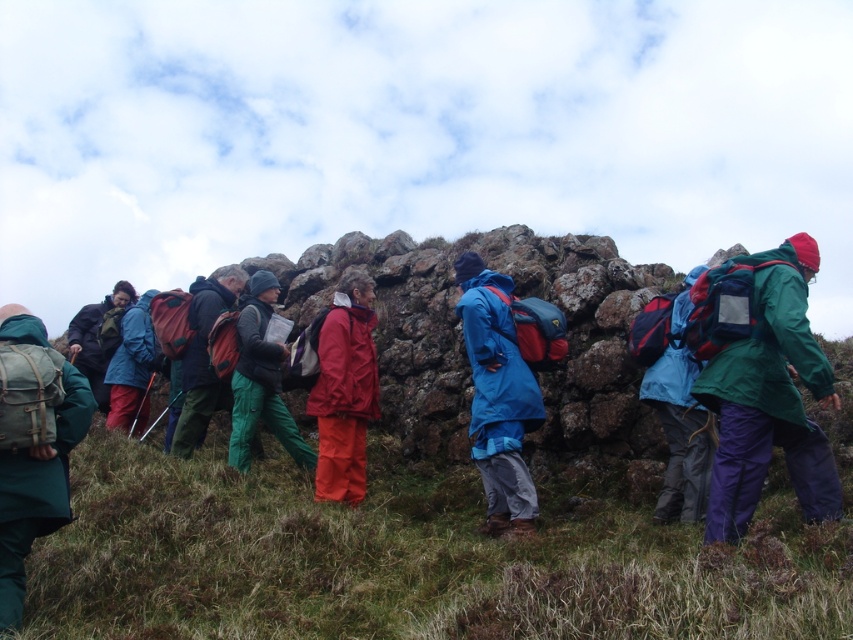
Question: Which of the following is the closest to the observer?

Choices:
 (A) green matte jacket at center
 (B) green canvas backpack at left
 (C) blue matte jacket at center
 (D) green fabric jacket at center

Answer: (B)

Question: Which object is closer to the camera taking this photo?

Choices:
 (A) green canvas backpack at left
 (B) green matte jacket at center
 (C) matte black jacket at left
 (D) matte red pants at center

Answer: (A)

Question: Is matte red backpack at center positioned in front of matte blue jacket at center?

Choices:
 (A) yes
 (B) no

Answer: (A)

Question: Which of the following is the closest to the observer?

Choices:
 (A) (4, 330)
 (B) (198, 344)

Answer: (A)

Question: Is green matte jacket at center to the left of matte black jacket at left from the viewer's perspective?

Choices:
 (A) yes
 (B) no

Answer: (B)

Question: Can you confirm if matte red backpack at center is positioned to the right of matte blue jacket at center?

Choices:
 (A) no
 (B) yes

Answer: (B)